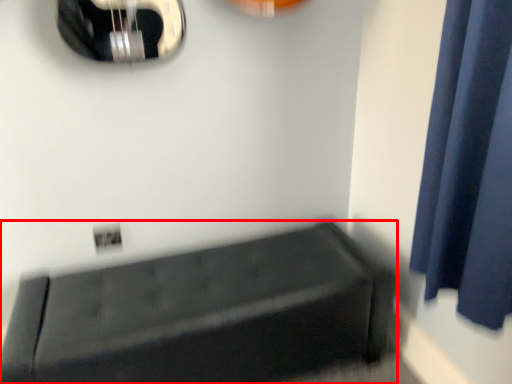
Question: From the image's perspective, considering the relative positions of furniture (annotated by the red box) and curtain in the image provided, where is furniture (annotated by the red box) located with respect to the staircase?

Choices:
 (A) above
 (B) below

Answer: (B)